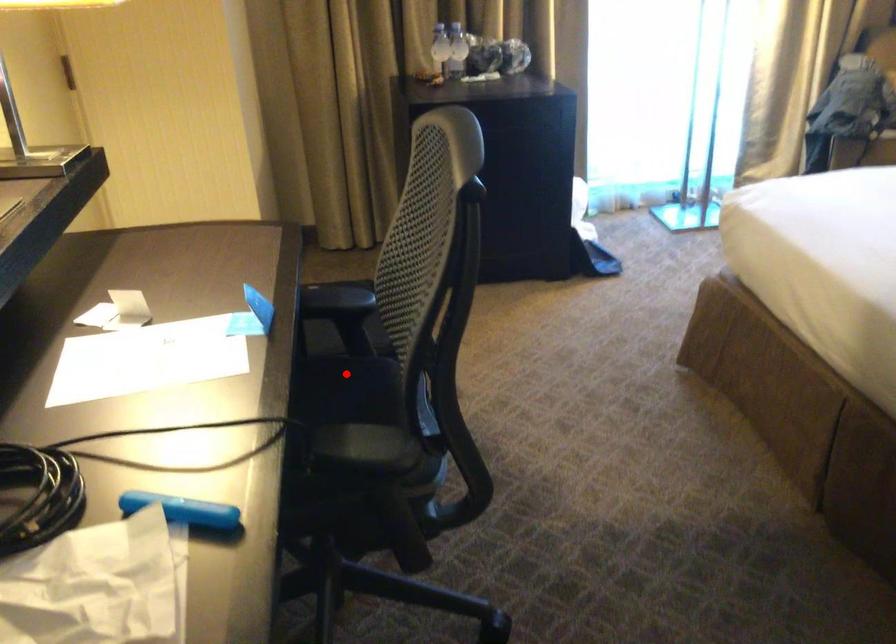
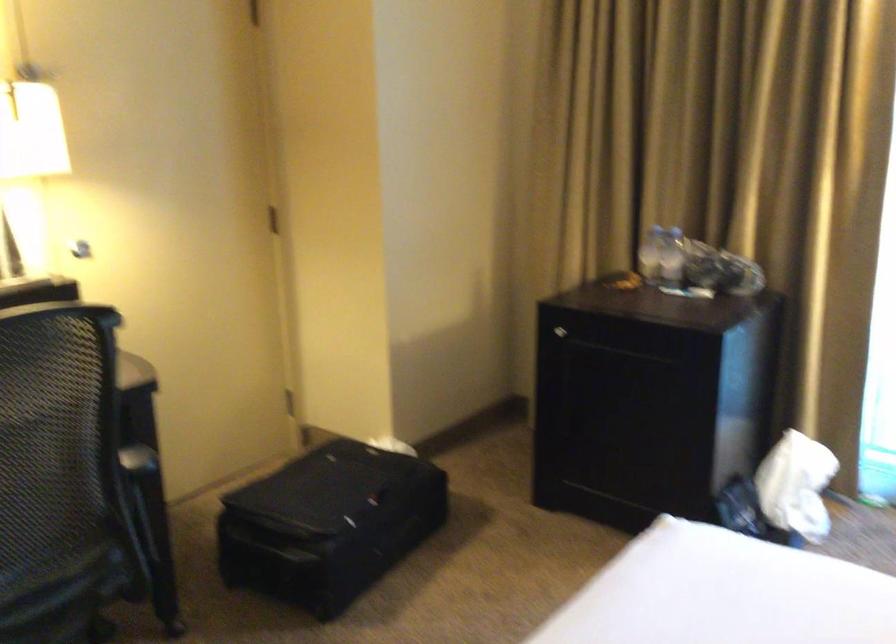
Where in the second image is the point corresponding to the highlighted location from the first image?

(136, 527)